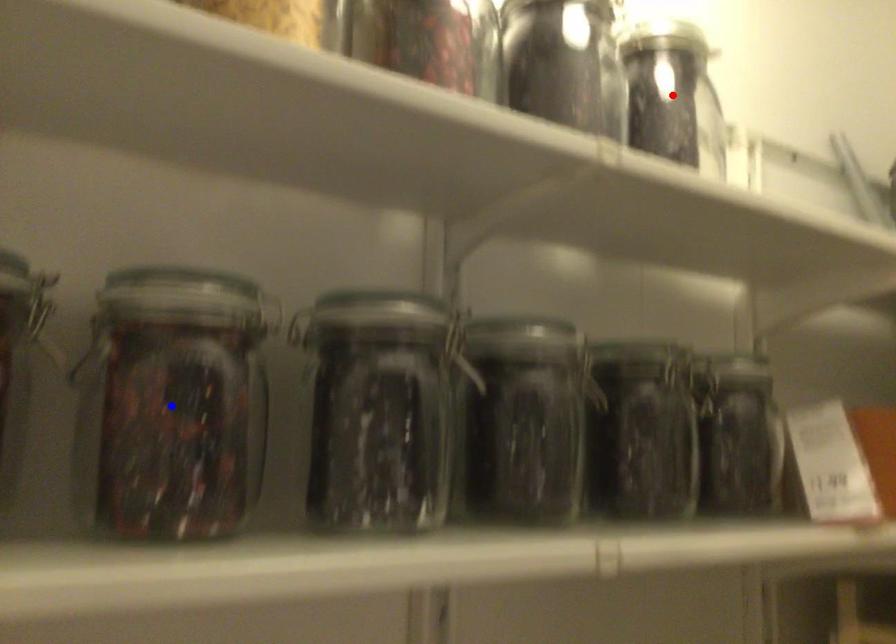
Question: In the image, two points are highlighted. Which point is nearer to the camera? Reply with the corresponding letter.

Choices:
 (A) blue point
 (B) red point

Answer: (A)